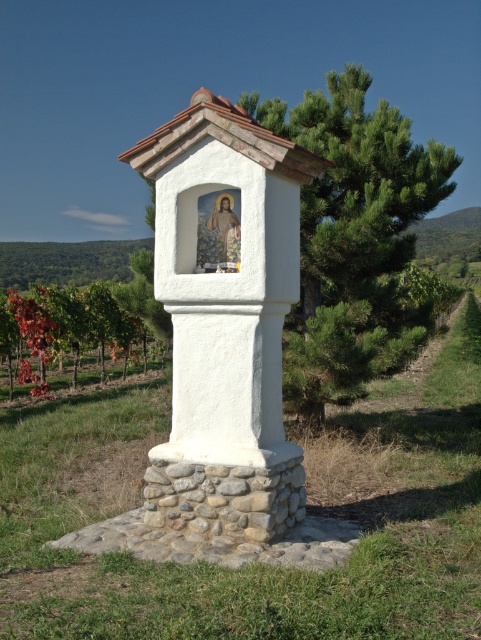
How distant is white stucco column at center from reddish-brown vine at left?

white stucco column at center is 21.49 feet away from reddish-brown vine at left.

Who is taller, white stucco column at center or reddish-brown vine at left?

reddish-brown vine at left is taller.

Locate an element on the screen. white stucco column at center is located at coordinates click(225, 321).

Locate an element on the screen. This screenshot has height=640, width=481. white stucco column at center is located at coordinates (225, 321).

What do you see at coordinates (225, 321) in the screenshot?
I see `white stucco column at center` at bounding box center [225, 321].

Between point (275, 448) and point (318, 400), which one is positioned in front?

Point (275, 448) is more forward.

At what (x,y) coordinates should I click in order to perform the action: click on white stucco column at center. Please return your answer as a coordinate pair (x, y). The width and height of the screenshot is (481, 640). Looking at the image, I should click on (225, 321).

Does green leafy tree at center have a greater width compared to reddish-brown vine at left?

No.

Who is positioned more to the right, green leafy tree at center or reddish-brown vine at left?

From the viewer's perspective, green leafy tree at center appears more on the right side.

Measure the distance between green leafy tree at center and camera.

They are 9.34 meters apart.

Identify the location of green leafy tree at center. This screenshot has height=640, width=481. (354, 237).